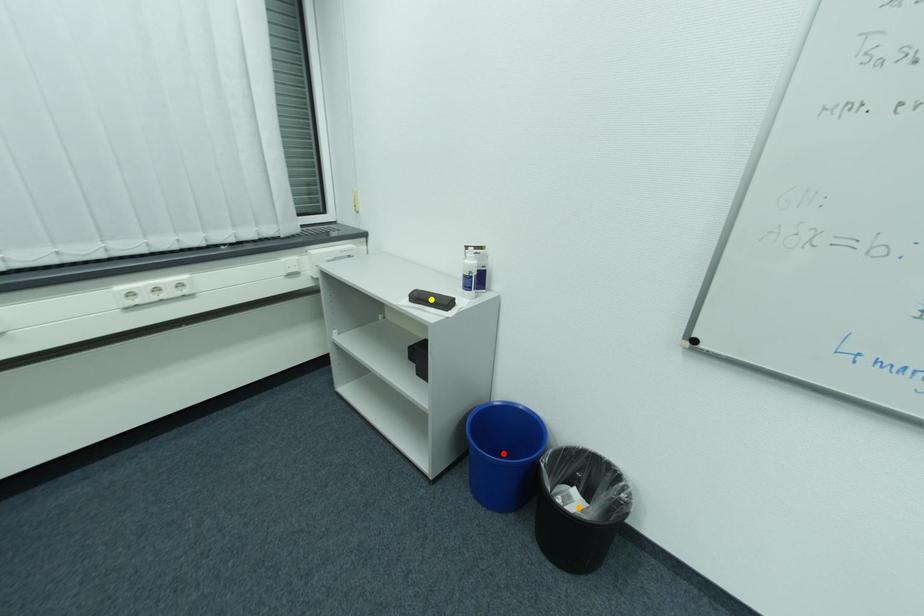
In the scene shown: Order these from nearest to farthest:
1. orange point
2. yellow point
3. red point

yellow point → orange point → red point